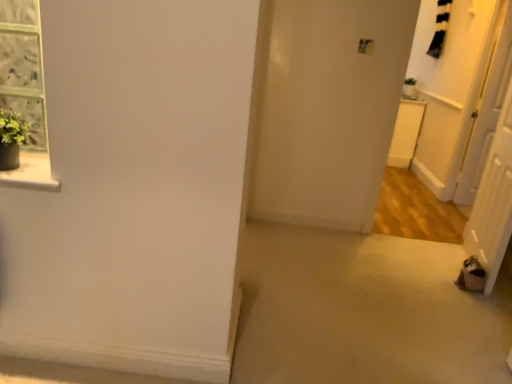
Question: Considering the positions of point (473, 170) and point (505, 150), is point (473, 170) closer or farther from the camera than point (505, 150)?

Choices:
 (A) closer
 (B) farther

Answer: (B)

Question: Considering the positions of white glossy door at right, acting as the 1th screen door starting from the right, and brown fabric screen door at lower right, which is the 1th screen door from front to back, in the image, is white glossy door at right, acting as the 1th screen door starting from the right, wider or thinner than brown fabric screen door at lower right, which is the 1th screen door from front to back,?

Choices:
 (A) thin
 (B) wide

Answer: (A)

Question: Considering the positions of white glossy door at right, the first screen door in the back-to-front sequence, and brown fabric screen door at lower right, the 2th screen door viewed from the right, in the image, is white glossy door at right, the first screen door in the back-to-front sequence, taller or shorter than brown fabric screen door at lower right, the 2th screen door viewed from the right,?

Choices:
 (A) short
 (B) tall

Answer: (B)

Question: Based on their sizes in the image, would you say brown fabric screen door at lower right, the 1th screen door from the left, is bigger or smaller than white glossy door at right, marked as the 2th screen door in a front-to-back arrangement?

Choices:
 (A) small
 (B) big

Answer: (B)

Question: Considering their positions, is brown fabric screen door at lower right, the 1th screen door from the left, located in front of or behind white glossy door at right, which is the second screen door from left to right?

Choices:
 (A) behind
 (B) front

Answer: (B)

Question: Is brown fabric screen door at lower right, positioned as the second screen door in back-to-front order, spatially inside white glossy door at right, acting as the 1th screen door starting from the right, or outside of it?

Choices:
 (A) inside
 (B) outside

Answer: (B)

Question: Is brown fabric screen door at lower right, which is the 1th screen door from front to back, wider or thinner than white glossy door at right, the first screen door in the back-to-front sequence?

Choices:
 (A) wide
 (B) thin

Answer: (A)